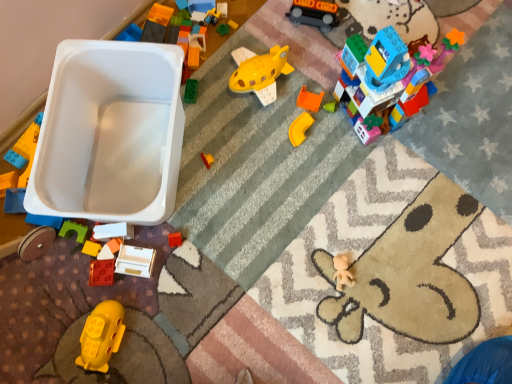
Locate an element on the screen. free point to the right of multicolored plastic building block at upper right, which is the eighth toy in left-to-right order is located at coordinates (457, 112).